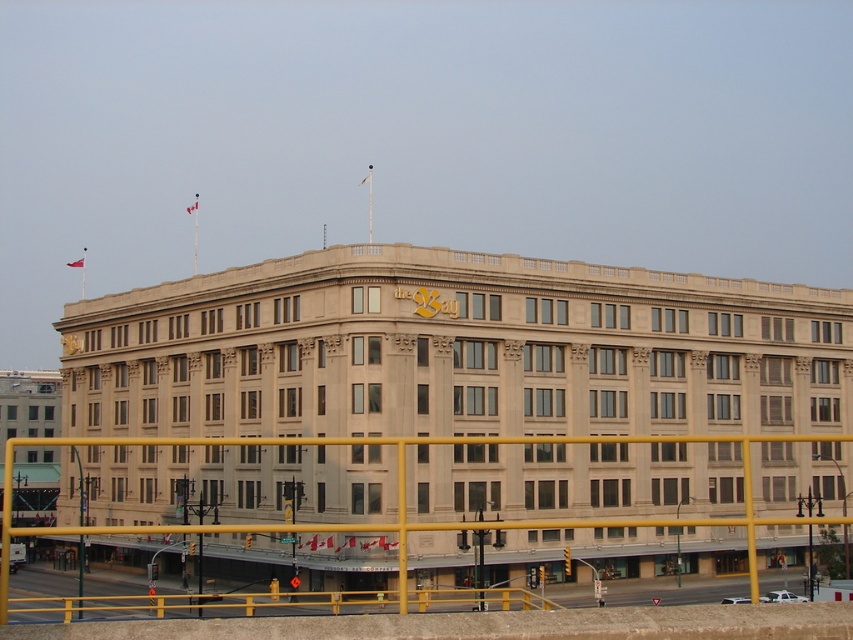
Does point (77, 552) come closer to viewer compared to point (78, 339)?

Yes, it is in front of point (78, 339).

Which is in front, point (78, 552) or point (80, 346)?

Point (78, 552)

Does point (77, 573) come farther from viewer compared to point (67, 344)?

No, it is in front of (67, 344).

Find the location of a particular element. yellow metallic pole at lower left is located at coordinates (79, 484).